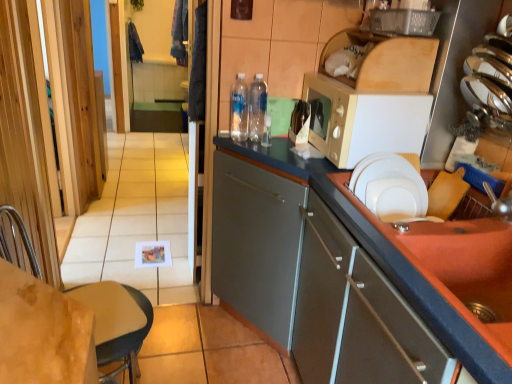
Measure the distance between white matte microwave at upper right and camera.

white matte microwave at upper right and camera are 1.41 meters apart.

This screenshot has width=512, height=384. What do you see at coordinates (257, 108) in the screenshot? I see `clear plastic bottles at center, which appears as the second bottle when viewed from the right` at bounding box center [257, 108].

In order to face clear plastic bottles at center, which appears as the second bottle when viewed from the right, should I rotate leftwards or rightwards?

Turn right by 0.428 degrees to look at clear plastic bottles at center, which appears as the second bottle when viewed from the right.

What do you see at coordinates (356, 315) in the screenshot? This screenshot has width=512, height=384. I see `matte gray cabinet at right, acting as the 2th cabinetry starting from the back` at bounding box center [356, 315].

What are the coordinates of `dark blue fabric at upper left, the first laundry viewed from the left` in the screenshot? It's located at (134, 44).

Identify the location of blue fabric laundry at upper left, which is the first laundry in right-to-left order. The image size is (512, 384). (180, 32).

How much space does matte gray cabinet at right, which is counted as the second cabinetry, starting from the front, occupy horizontally?

The width of matte gray cabinet at right, which is counted as the second cabinetry, starting from the front, is 38.99 inches.

The image size is (512, 384). What are the coordinates of `translucent glass bottle at center, which is the 3th bottle in left-to-right order` in the screenshot? It's located at (300, 122).

Image resolution: width=512 pixels, height=384 pixels. Identify the location of white matte microwave at upper right. (362, 121).

Which is farther from the camera, (323, 378) or (176, 41)?

The point (176, 41) is behind.

Would you say matte gray cabinet at right, which is counted as the second cabinetry, starting from the front, is outside blue fabric laundry at upper left, the 2th laundry when ordered from back to front?

matte gray cabinet at right, which is counted as the second cabinetry, starting from the front, lies outside blue fabric laundry at upper left, the 2th laundry when ordered from back to front,'s area.

Could you measure the distance between matte gray cabinet at right, marked as the first cabinetry in a back-to-front arrangement, and blue fabric laundry at upper left, positioned as the 1th laundry in front-to-back order?

matte gray cabinet at right, marked as the first cabinetry in a back-to-front arrangement, is 2.31 meters from blue fabric laundry at upper left, positioned as the 1th laundry in front-to-back order.

Considering their positions, is matte gray cabinet at right, which is counted as the second cabinetry, starting from the front, located in front of or behind blue fabric laundry at upper left, which is the first laundry in right-to-left order?

Visually, matte gray cabinet at right, which is counted as the second cabinetry, starting from the front, is located in front of blue fabric laundry at upper left, which is the first laundry in right-to-left order.

Is white matte microwave at upper right oriented away from matte gray cabinet at right, which is the 1th cabinetry in front-to-back order?

No, white matte microwave at upper right is not facing the opposite direction of matte gray cabinet at right, which is the 1th cabinetry in front-to-back order.

From a real-world perspective, starting from the white matte microwave at upper right, which cabinetry is the 1st one below it? Please provide its 2D coordinates.

[(356, 315)]

Is white matte microwave at upper right wider or thinner than matte gray cabinet at right, which is the 1th cabinetry in front-to-back order?

Clearly, white matte microwave at upper right has less width compared to matte gray cabinet at right, which is the 1th cabinetry in front-to-back order.

From a real-world perspective, between white matte microwave at upper right and matte gray cabinet at right, acting as the 2th cabinetry starting from the back, who is vertically higher?

white matte microwave at upper right.

Is matte gray cabinet at right, which is counted as the second cabinetry, starting from the front, directly adjacent to dark blue fabric at upper left, the 2th laundry from the right?

No, matte gray cabinet at right, which is counted as the second cabinetry, starting from the front, is not making contact with dark blue fabric at upper left, the 2th laundry from the right.

Considering the positions of points (497, 360) and (139, 38), is point (497, 360) closer to camera compared to point (139, 38)?

Yes, point (497, 360) is closer to viewer.

This screenshot has width=512, height=384. In order to click on the 1st cabinetry in front of the dark blue fabric at upper left, the second laundry when ordered from front to back, counting from the anchor's position in this screenshot , I will do `click(349, 271)`.

From the image's perspective, who appears lower, matte gray cabinet at right, marked as the first cabinetry in a back-to-front arrangement, or dark blue fabric at upper left, the 2th laundry from the right?

matte gray cabinet at right, marked as the first cabinetry in a back-to-front arrangement, appears lower in the image.

Measure the distance from dark blue fabric at upper left, the second laundry when ordered from front to back, to transparent wooden screen door at left.

dark blue fabric at upper left, the second laundry when ordered from front to back, is 2.60 meters from transparent wooden screen door at left.

Is dark blue fabric at upper left, arranged as the 1th laundry when viewed from the back, at the left side of transparent wooden screen door at left?

Yes, dark blue fabric at upper left, arranged as the 1th laundry when viewed from the back, is to the left of transparent wooden screen door at left.

In the scene shown: Is dark blue fabric at upper left, the 2th laundry from the right, oriented towards transparent wooden screen door at left?

Yes, dark blue fabric at upper left, the 2th laundry from the right, is facing transparent wooden screen door at left.

Considering the positions of points (133, 49) and (71, 214), is point (133, 49) farther from camera compared to point (71, 214)?

Yes, point (133, 49) is farther from viewer.

Which point is more forward, (237, 104) or (95, 310)?

The point (95, 310) is more forward.

Which object is more forward, clear plastic water bottles at center, the 1th bottle in the left-to-right sequence, or light brown leather chair at lower left?

light brown leather chair at lower left is in front.

Is clear plastic water bottles at center, the 1th bottle in the left-to-right sequence, aimed at light brown leather chair at lower left?

No, clear plastic water bottles at center, the 1th bottle in the left-to-right sequence, is not turned towards light brown leather chair at lower left.

Is dark blue fabric at upper left, arranged as the 1th laundry when viewed from the back, turned away from light brown leather chair at lower left?

dark blue fabric at upper left, arranged as the 1th laundry when viewed from the back, does not have its back to light brown leather chair at lower left.

Is dark blue fabric at upper left, the second laundry when ordered from front to back, not close to light brown leather chair at lower left?

Absolutely, dark blue fabric at upper left, the second laundry when ordered from front to back, is distant from light brown leather chair at lower left.

From a real-world perspective, relative to matte gray cabinet at right, acting as the 2th cabinetry starting from the back, is translucent glass bottle at center, which is the 1th bottle in right-to-left order, vertically above or below?

translucent glass bottle at center, which is the 1th bottle in right-to-left order, is above matte gray cabinet at right, acting as the 2th cabinetry starting from the back.

From the translucent glass bottle at center, which is the 1th bottle in right-to-left order, count 2nd cabinetrys forward and point to it. Please provide its 2D coordinates.

[(356, 315)]

Between point (298, 118) and point (403, 338), which one is positioned in front?

Point (403, 338)

From the image's perspective, which is above, translucent glass bottle at center, which is the 3th bottle in left-to-right order, or matte gray cabinet at right, which is the 1th cabinetry in front-to-back order?

translucent glass bottle at center, which is the 3th bottle in left-to-right order, is shown above in the image.

Where is `the 1st cabinetry in front when counting from the blue fabric laundry at upper left, the 2th laundry when ordered from back to front`? The width and height of the screenshot is (512, 384). the 1st cabinetry in front when counting from the blue fabric laundry at upper left, the 2th laundry when ordered from back to front is located at coordinates (349, 271).

You are a GUI agent. You are given a task and a screenshot of the screen. Output one action in this format:
    pyautogui.click(x=<x>, y=<y>)
    Task: Click on the cabinetry on the right side of white matte microwave at upper right
    The height and width of the screenshot is (384, 512).
    Given the screenshot: What is the action you would take?
    pyautogui.click(x=356, y=315)

From the picture: Looking at the image, which one is located further to light brown leather chair at lower left, clear plastic bottles at center, which appears as the second bottle when viewed from the right, or clear plastic water bottles at center, the third bottle when ordered from right to left?

clear plastic bottles at center, which appears as the second bottle when viewed from the right, lies further to light brown leather chair at lower left than the other object.

When comparing their distances from light brown leather chair at lower left, does white matte microwave at upper right or clear plastic water bottles at center, the third bottle when ordered from right to left, seem further?

The object further to light brown leather chair at lower left is white matte microwave at upper right.

Estimate the real-world distances between objects in this image. Which object is closer to transparent wooden screen door at left, light brown leather chair at lower left or matte gray cabinet at right, marked as the first cabinetry in a back-to-front arrangement?

Based on the image, light brown leather chair at lower left appears to be nearer to transparent wooden screen door at left.

Which object lies further to the anchor point clear plastic bottles at center, which appears as the second bottle when viewed from the right, clear plastic water bottles at center, the 1th bottle in the left-to-right sequence, or translucent glass bottle at center, which is the 3th bottle in left-to-right order?

translucent glass bottle at center, which is the 3th bottle in left-to-right order, is positioned further to the anchor clear plastic bottles at center, which appears as the second bottle when viewed from the right.

Looking at the image, which one is located further to white matte microwave at upper right, matte gray cabinet at right, which is counted as the second cabinetry, starting from the front, or translucent glass bottle at center, which is the 1th bottle in right-to-left order?

Based on the image, matte gray cabinet at right, which is counted as the second cabinetry, starting from the front, appears to be further to white matte microwave at upper right.

Looking at the image, which one is located closer to transparent wooden screen door at left, blue fabric laundry at upper left, which is the first laundry in right-to-left order, or white matte microwave at upper right?

blue fabric laundry at upper left, which is the first laundry in right-to-left order, is closer to transparent wooden screen door at left.

When comparing their distances from transparent wooden screen door at left, does clear plastic bottles at center, which appears as the second bottle when viewed from the right, or translucent glass bottle at center, which is the 1th bottle in right-to-left order, seem closer?

clear plastic bottles at center, which appears as the second bottle when viewed from the right.

Considering their positions, is light brown leather chair at lower left positioned further to matte gray cabinet at right, which is counted as the second cabinetry, starting from the front, than clear plastic water bottles at center, the 1th bottle in the left-to-right sequence?

light brown leather chair at lower left is further to matte gray cabinet at right, which is counted as the second cabinetry, starting from the front.

You are a GUI agent. You are given a task and a screenshot of the screen. Output one action in this format:
    pyautogui.click(x=<x>, y=<y>)
    Task: Click on the screen door located between matte gray cabinet at right, acting as the 2th cabinetry starting from the back, and blue fabric laundry at upper left, the 2th laundry when ordered from back to front, in the depth direction
    This screenshot has width=512, height=384.
    Given the screenshot: What is the action you would take?
    pyautogui.click(x=58, y=102)

This screenshot has height=384, width=512. I want to click on microwave oven between matte gray cabinet at right, acting as the 2th cabinetry starting from the back, and translucent glass bottle at center, which is the 3th bottle in left-to-right order, along the z-axis, so click(362, 121).

Where is `microwave oven located between matte gray cabinet at right, which is the 1th cabinetry in front-to-back order, and matte gray cabinet at right, marked as the first cabinetry in a back-to-front arrangement, in the depth direction`? microwave oven located between matte gray cabinet at right, which is the 1th cabinetry in front-to-back order, and matte gray cabinet at right, marked as the first cabinetry in a back-to-front arrangement, in the depth direction is located at coordinates (362, 121).

Locate an element on the screen. The height and width of the screenshot is (384, 512). chair between matte gray cabinet at right, which is the 1th cabinetry in front-to-back order, and dark blue fabric at upper left, arranged as the 1th laundry when viewed from the back, from front to back is located at coordinates (116, 322).